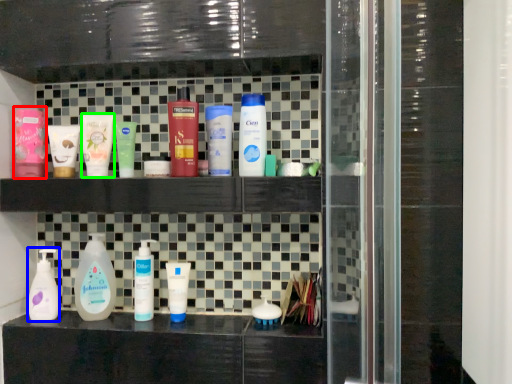
Question: Which object is the closest to the toiletry (highlighted by a red box)? Choose among these: cleaning product (highlighted by a blue box) or mouthwash (highlighted by a green box).

Choices:
 (A) cleaning product
 (B) mouthwash

Answer: (B)